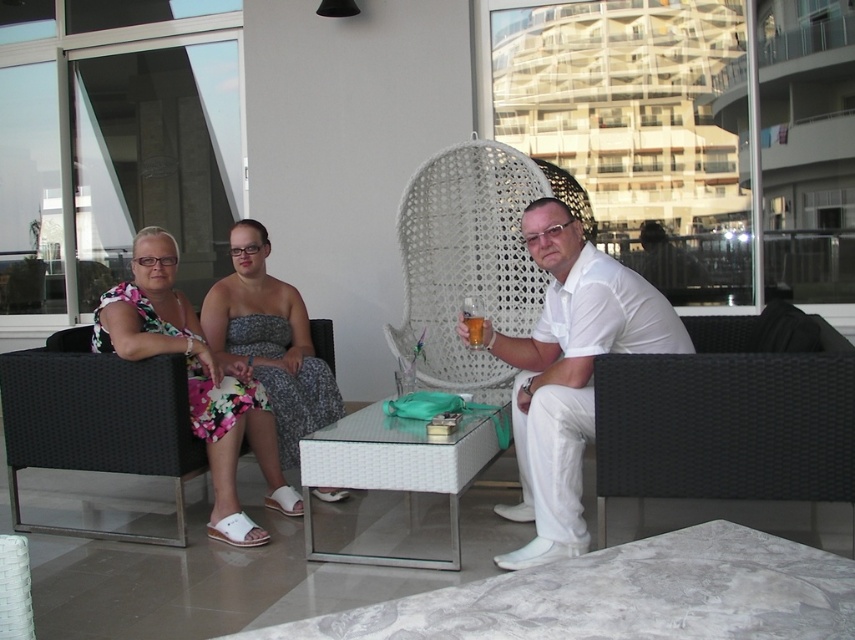
Question: Is the position of black woven armchair at right less distant than that of floral fabric dress at left?

Choices:
 (A) no
 (B) yes

Answer: (B)

Question: From the image, what is the correct spatial relationship of white matte shirt at center in relation to transparent glass table at center?

Choices:
 (A) below
 (B) above

Answer: (B)

Question: Which object is positioned farthest from the translucent glass cup at center?

Choices:
 (A) white matte shirt at center
 (B) black woven armchair at right

Answer: (B)

Question: Where is black woven armchair at right located in relation to floral fabric dress at center in the image?

Choices:
 (A) above
 (B) below

Answer: (B)

Question: Which object is the closest to the transparent glass table at center?

Choices:
 (A) floral fabric dress at left
 (B) translucent glass cup at center
 (C) floral fabric dress at center

Answer: (B)

Question: Which of the following is the closest to the observer?

Choices:
 (A) (478, 333)
 (B) (652, 356)

Answer: (B)